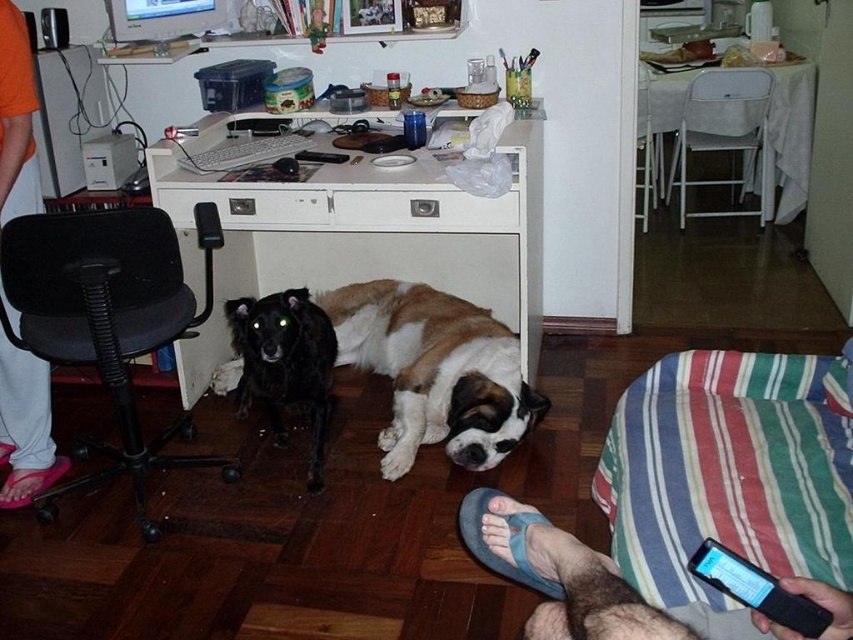
Is black mesh office chair at left smaller than orange fabric pants at lower left?

Actually, black mesh office chair at left might be larger than orange fabric pants at lower left.

Can you confirm if black mesh office chair at left is positioned to the left of orange fabric pants at lower left?

In fact, black mesh office chair at left is to the right of orange fabric pants at lower left.

The image size is (853, 640). Find the location of `black mesh office chair at left`. black mesh office chair at left is located at coordinates (108, 317).

You are a GUI agent. You are given a task and a screenshot of the screen. Output one action in this format:
    pyautogui.click(x=<x>, y=<y>)
    Task: Click on the black mesh office chair at left
    
    Given the screenshot: What is the action you would take?
    pyautogui.click(x=108, y=317)

Which is more to the right, white wood computer desk at center or brown and white fur at center?

brown and white fur at center is more to the right.

Looking at this image, who is shorter, white wood computer desk at center or brown and white fur at center?

brown and white fur at center

Does point (335, 205) come farther from viewer compared to point (469, 396)?

Yes, point (335, 205) is behind point (469, 396).

Where is `white wood computer desk at center`? Image resolution: width=853 pixels, height=640 pixels. white wood computer desk at center is located at coordinates (363, 237).

Can you confirm if white wood computer desk at center is shorter than gray fabric leg at lower right?

Incorrect, white wood computer desk at center's height does not fall short of gray fabric leg at lower right's.

Who is more forward, (430, 168) or (503, 550)?

Point (503, 550)

Which is in front, point (235, 228) or point (498, 552)?

Point (498, 552) is more forward.

You are a GUI agent. You are given a task and a screenshot of the screen. Output one action in this format:
    pyautogui.click(x=<x>, y=<y>)
    Task: Click on the white wood computer desk at center
    This screenshot has width=853, height=640.
    Given the screenshot: What is the action you would take?
    pyautogui.click(x=363, y=237)